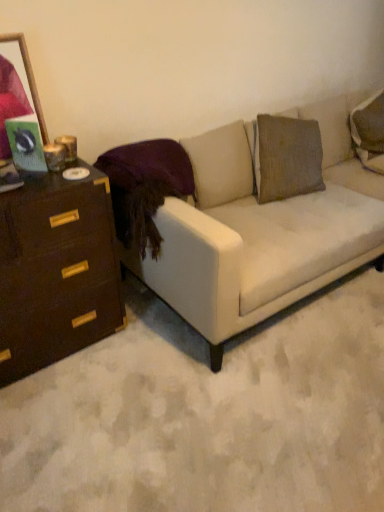
Locate an element on the screen. This screenshot has width=384, height=512. velvet purple pillow at upper left is located at coordinates (149, 166).

Locate an element on the screen. This screenshot has height=512, width=384. dark brown wood chest of drawers at left is located at coordinates (56, 271).

Are dark brown wood chest of drawers at left and velvet purple pillow at upper left located far from each other?

dark brown wood chest of drawers at left is near velvet purple pillow at upper left, not far away.

Is dark brown wood chest of drawers at left inside or outside of velvet purple pillow at upper left?

dark brown wood chest of drawers at left is not enclosed by velvet purple pillow at upper left.

Is dark brown wood chest of drawers at left further to the viewer compared to velvet purple pillow at upper left?

No, it is not.

Who is smaller, dark brown wood chest of drawers at left or velvet purple pillow at upper left?

velvet purple pillow at upper left.

Is wooden picture frame at upper left to the left or to the right of velvet purple pillow at upper left in the image?

Clearly, wooden picture frame at upper left is on the left of velvet purple pillow at upper left in the image.

Between point (37, 122) and point (165, 139), which one is positioned behind?

The point (165, 139) is farther.

Is there a large distance between wooden picture frame at upper left and velvet purple pillow at upper left?

They are positioned close to each other.

Is wooden picture frame at upper left wider or thinner than white fabric couch at center?

Clearly, wooden picture frame at upper left has less width compared to white fabric couch at center.

Is wooden picture frame at upper left taller or shorter than white fabric couch at center?

In the image, wooden picture frame at upper left appears to be shorter than white fabric couch at center.

In the image, there is a white fabric couch at center. In order to click on picture frame above it (from the image's perspective) in this screenshot , I will do `click(18, 95)`.

From the image's perspective, is velvet purple pillow at upper left beneath dark brown wood chest of drawers at left?

No.

Is the position of velvet purple pillow at upper left more distant than that of dark brown wood chest of drawers at left?

Yes, it is behind dark brown wood chest of drawers at left.

Is velvet purple pillow at upper left facing towards dark brown wood chest of drawers at left?

No, velvet purple pillow at upper left is not facing towards dark brown wood chest of drawers at left.

Is velvet purple pillow at upper left far away from dark brown wood chest of drawers at left?

No, velvet purple pillow at upper left is not far from dark brown wood chest of drawers at left.

Where is `pillow located above the white fabric couch at center (from the image's perspective)`? The height and width of the screenshot is (512, 384). pillow located above the white fabric couch at center (from the image's perspective) is located at coordinates (149, 166).

From a real-world perspective, which is physically below, velvet purple pillow at upper left or white fabric couch at center?

white fabric couch at center, from a real-world perspective.

Looking at the image, does velvet purple pillow at upper left seem bigger or smaller compared to white fabric couch at center?

velvet purple pillow at upper left is smaller than white fabric couch at center.

Is velvet purple pillow at upper left directly adjacent to white fabric couch at center?

velvet purple pillow at upper left and white fabric couch at center are not in contact.

Is white fabric couch at center with dark brown wood chest of drawers at left?

No, white fabric couch at center is not in contact with dark brown wood chest of drawers at left.

Is point (349, 246) closer to viewer compared to point (1, 293)?

No, it is behind (1, 293).

Is white fabric couch at center bigger or smaller than dark brown wood chest of drawers at left?

Answer: In the image, white fabric couch at center appears to be larger than dark brown wood chest of drawers at left.

Can you tell me how much white fabric couch at center and dark brown wood chest of drawers at left differ in facing direction?

white fabric couch at center and dark brown wood chest of drawers at left are facing 0.249 degrees away from each other.

Which object is positioned more to the right, velvet purple pillow at upper left or wooden picture frame at upper left?

velvet purple pillow at upper left.

Considering the positions of points (157, 141) and (26, 83), is point (157, 141) farther from camera compared to point (26, 83)?

Yes.

Consider the image. Can you see velvet purple pillow at upper left touching wooden picture frame at upper left?

No, velvet purple pillow at upper left is not beside wooden picture frame at upper left.

Where is `pillow to the right of dark brown wood chest of drawers at left`? This screenshot has height=512, width=384. pillow to the right of dark brown wood chest of drawers at left is located at coordinates (149, 166).

Where is `pillow directly beneath the wooden picture frame at upper left (from a real-world perspective)`? pillow directly beneath the wooden picture frame at upper left (from a real-world perspective) is located at coordinates (149, 166).

Looking at the image, which one is located further to dark brown wood chest of drawers at left, wooden picture frame at upper left or white fabric couch at center?

white fabric couch at center is positioned further to the anchor dark brown wood chest of drawers at left.

When comparing their distances from velvet purple pillow at upper left, does white fabric couch at center or dark brown wood chest of drawers at left seem closer?

Based on the image, dark brown wood chest of drawers at left appears to be nearer to velvet purple pillow at upper left.

Based on their spatial positions, is dark brown wood chest of drawers at left or velvet purple pillow at upper left closer to wooden picture frame at upper left?

dark brown wood chest of drawers at left is closer to wooden picture frame at upper left.

From the image, which object appears to be nearer to white fabric couch at center, dark brown wood chest of drawers at left or wooden picture frame at upper left?

dark brown wood chest of drawers at left is positioned closer to the anchor white fabric couch at center.

When comparing their distances from velvet purple pillow at upper left, does wooden picture frame at upper left or white fabric couch at center seem closer?

The object closer to velvet purple pillow at upper left is wooden picture frame at upper left.

From the picture: Which object lies further to the anchor point velvet purple pillow at upper left, wooden picture frame at upper left or dark brown wood chest of drawers at left?

wooden picture frame at upper left is further to velvet purple pillow at upper left.

Estimate the real-world distances between objects in this image. Which object is further from dark brown wood chest of drawers at left, white fabric couch at center or wooden picture frame at upper left?

The object further to dark brown wood chest of drawers at left is white fabric couch at center.

Estimate the real-world distances between objects in this image. Which object is further from wooden picture frame at upper left, white fabric couch at center or velvet purple pillow at upper left?

Based on the image, white fabric couch at center appears to be further to wooden picture frame at upper left.

Identify the location of chest of drawers between wooden picture frame at upper left and white fabric couch at center. (56, 271).

At what (x,y) coordinates should I click in order to perform the action: click on pillow between dark brown wood chest of drawers at left and white fabric couch at center in the horizontal direction. Please return your answer as a coordinate pair (x, y). Looking at the image, I should click on (149, 166).

The width and height of the screenshot is (384, 512). I want to click on pillow between wooden picture frame at upper left and dark brown wood chest of drawers at left from top to bottom, so click(149, 166).

At what (x,y) coordinates should I click in order to perform the action: click on pillow located between wooden picture frame at upper left and white fabric couch at center in the left-right direction. Please return your answer as a coordinate pair (x, y). Looking at the image, I should click on (149, 166).